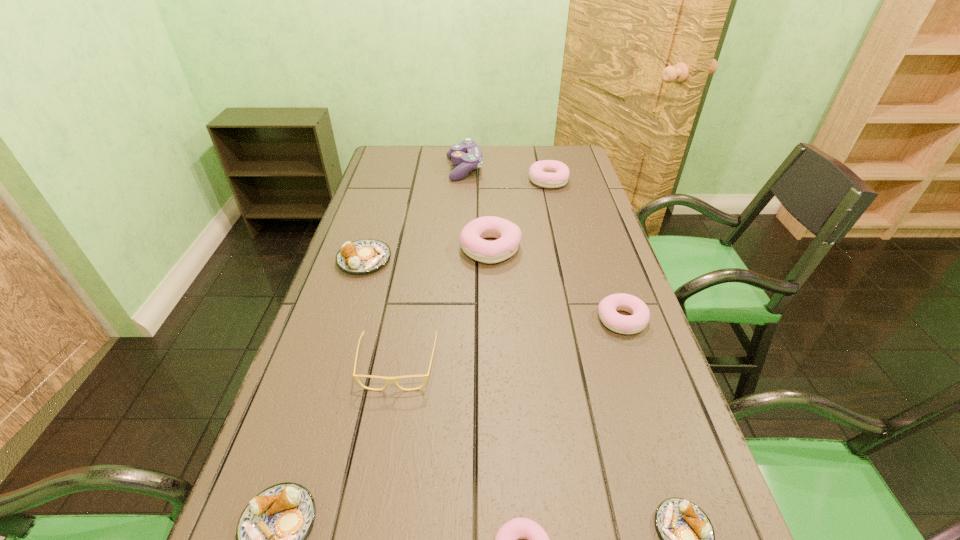
Locate an element on the screen. This screenshot has width=960, height=540. purple control is located at coordinates (467, 154).

Image resolution: width=960 pixels, height=540 pixels. In order to click on the tallest object in this screenshot , I will do `click(467, 154)`.

You are a GUI agent. You are given a task and a screenshot of the screen. Output one action in this format:
    pyautogui.click(x=<x>, y=<y>)
    Task: Click on the second farthest pink pastry
    Image resolution: width=960 pixels, height=540 pixels.
    Given the screenshot: What is the action you would take?
    pyautogui.click(x=508, y=234)

I want to click on the tallest pastry, so click(508, 234).

This screenshot has height=540, width=960. I want to click on the farthest pink pastry, so click(547, 173).

Identify the location of the farthest pastry. (547, 173).

This screenshot has height=540, width=960. I want to click on the biggest brown pastry, so click(366, 255).

At what (x,y) coordinates should I click in order to perform the action: click on spectacles. Please return your answer as a coordinate pair (x, y). Looking at the image, I should click on (386, 379).

The width and height of the screenshot is (960, 540). I want to click on the fourth nearest object, so click(x=386, y=379).

Identify the location of the second nearest pink pastry. (640, 315).